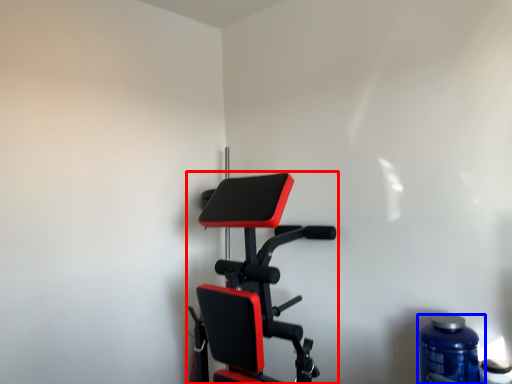
Question: Which of the following is the closest to the observer, stationary bicycle (highlighted by a red box) or bottle (highlighted by a blue box)?

Choices:
 (A) stationary bicycle
 (B) bottle

Answer: (A)